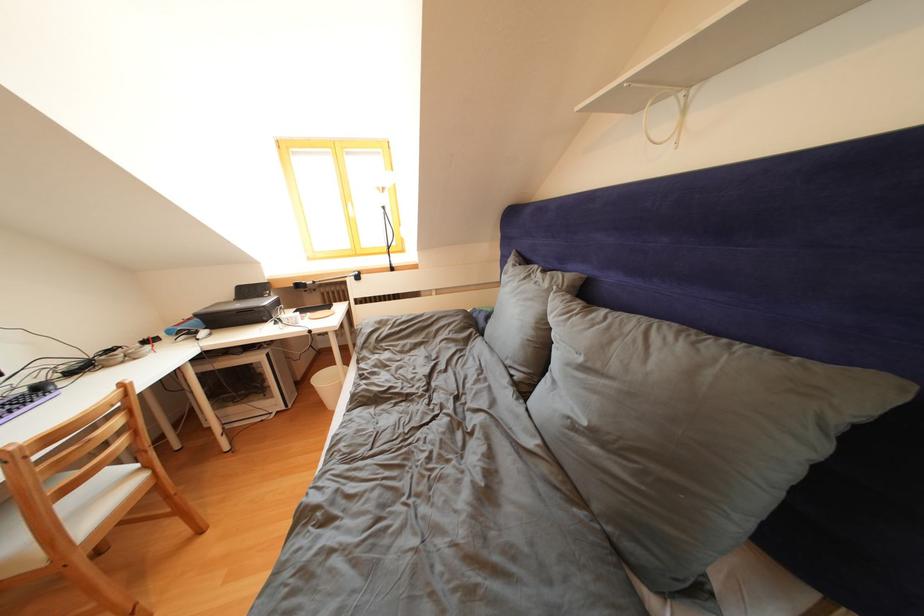
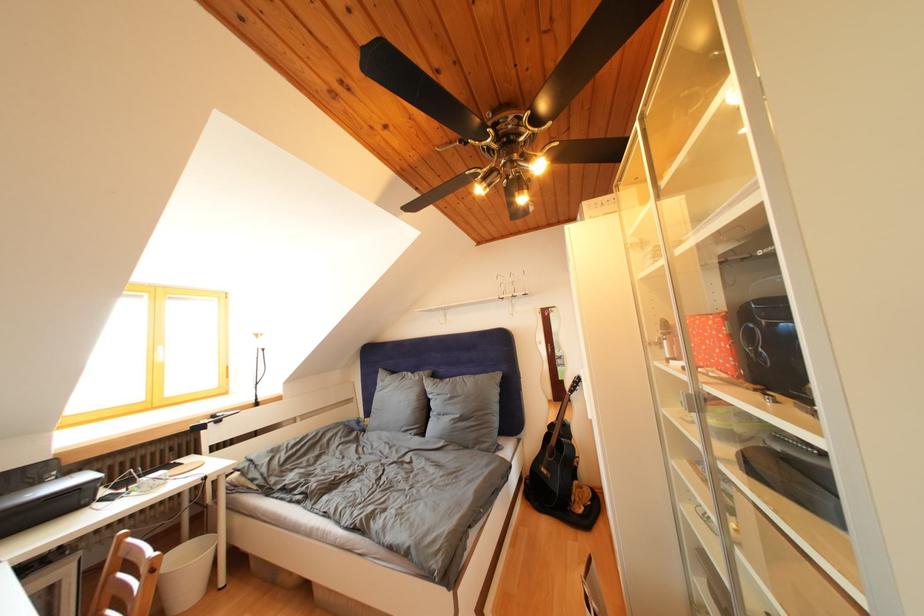
In the second image, find the point that corresponds to pixel 269 301 in the first image.

(44, 488)